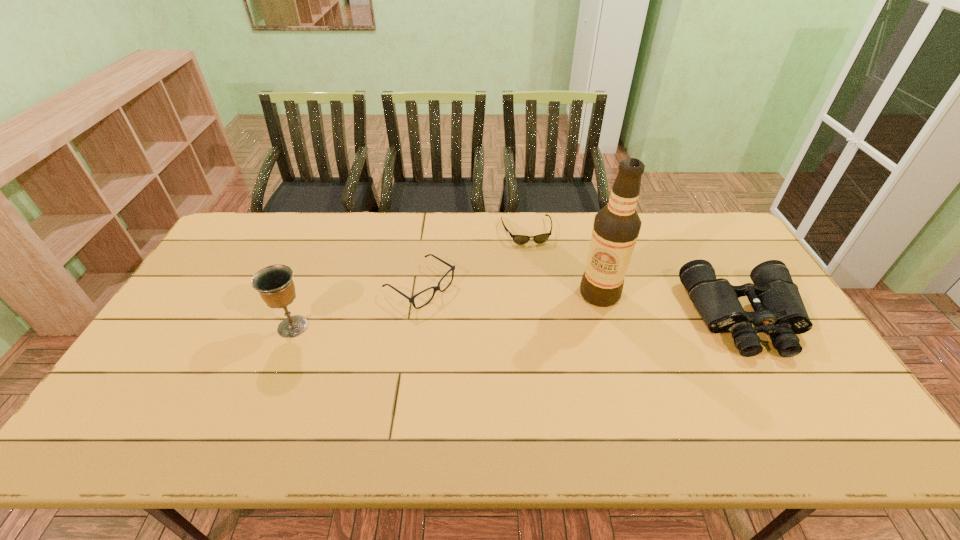
The height and width of the screenshot is (540, 960). I want to click on vacant space located 0.050m on the left of the leftmost object, so click(257, 327).

You are a GUI agent. You are given a task and a screenshot of the screen. Output one action in this format:
    pyautogui.click(x=<x>, y=<y>)
    Task: Click on the free location located 0.140m through the eyepieces of the third tallest object
    
    Given the screenshot: What is the action you would take?
    pyautogui.click(x=797, y=407)

The image size is (960, 540). Find the location of `free space located 0.060m on the label of the second object from right to left`. free space located 0.060m on the label of the second object from right to left is located at coordinates (568, 309).

The width and height of the screenshot is (960, 540). I want to click on vacant space located 0.340m on the label of the second object from right to left, so click(489, 350).

This screenshot has width=960, height=540. I want to click on vacant space located on the label of the second object from right to left, so click(495, 347).

Where is `free region located 0.240m on the front-facing side of the spectacles`? This screenshot has height=540, width=960. free region located 0.240m on the front-facing side of the spectacles is located at coordinates (510, 345).

At what (x,y) coordinates should I click in order to perform the action: click on vacant space located on the front-facing side of the spectacles. Please return your answer as a coordinate pair (x, y). The image size is (960, 540). Looking at the image, I should click on point(490,332).

Locate an element on the screen. The height and width of the screenshot is (540, 960). free space located on the front-facing side of the spectacles is located at coordinates (553, 373).

You are a GUI agent. You are given a task and a screenshot of the screen. Output one action in this format:
    pyautogui.click(x=<x>, y=<y>)
    Task: Click on the free spot located on the front-facing side of the sunglasses
    The height and width of the screenshot is (540, 960).
    Given the screenshot: What is the action you would take?
    pyautogui.click(x=556, y=336)

I want to click on vacant space located on the front-facing side of the sunglasses, so click(x=536, y=265).